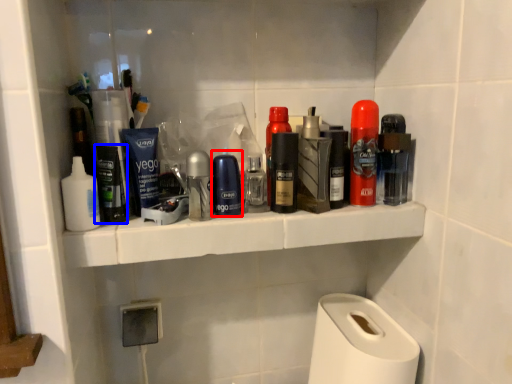
Question: Which object appears closest to the camera in this image, personal care (highlighted by a red box) or personal care (highlighted by a blue box)?

Choices:
 (A) personal care
 (B) personal care

Answer: (B)